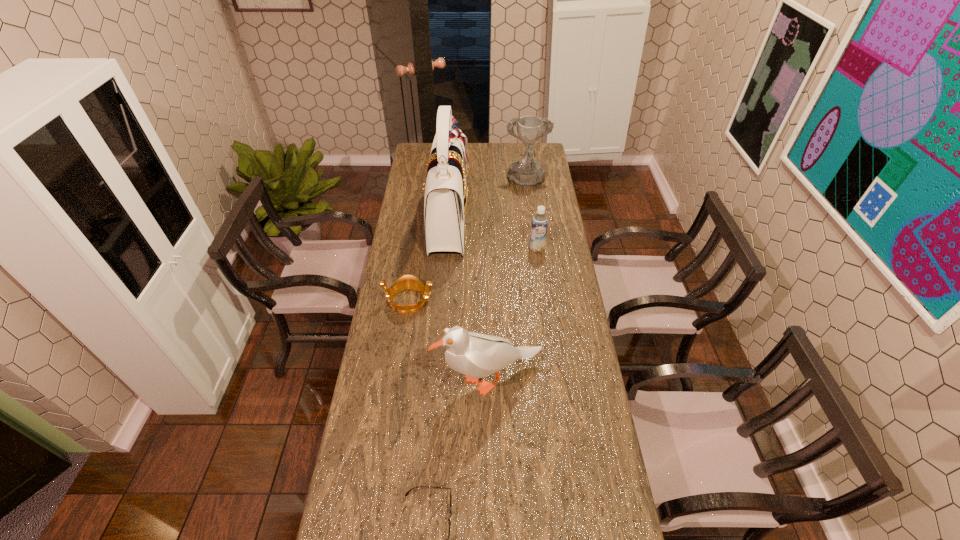
In the image, there is a desktop. Find the location of `vacant space at the far right corner`. vacant space at the far right corner is located at coordinates (533, 157).

Image resolution: width=960 pixels, height=540 pixels. I want to click on free space between the tallest object and the fourth tallest object, so click(492, 233).

Where is `free space between the third shortest object and the second shortest object`? The width and height of the screenshot is (960, 540). free space between the third shortest object and the second shortest object is located at coordinates (473, 274).

This screenshot has width=960, height=540. What are the coordinates of `vacant point located between the second nearest object and the satchel` in the screenshot? It's located at (468, 299).

You are a GUI agent. You are given a task and a screenshot of the screen. Output one action in this format:
    pyautogui.click(x=<x>, y=<y>)
    Task: Click on the free point between the award and the tiara
    The height and width of the screenshot is (540, 960).
    Given the screenshot: What is the action you would take?
    pyautogui.click(x=468, y=241)

Identify the location of the fifth closest object to the gull. Image resolution: width=960 pixels, height=540 pixels. (527, 172).

Choose which object is the third nearest neighbor to the second nearest object. Please provide its 2D coordinates. Your answer should be formatted as a tuple, i.e. [(x, y)], where the tuple contains the x and y coordinates of a point satisfying the conditions above.

[(446, 196)]

This screenshot has width=960, height=540. Identify the location of blank area in the image that satisfies the following two spatial constraints: 1. on the side with emblem of the award; 2. at the front emblem of the second shortest object. (541, 301).

Where is `free space that satisfies the following two spatial constraints: 1. on the side with emblem of the award; 2. at the beak of the second nearest object`? This screenshot has width=960, height=540. free space that satisfies the following two spatial constraints: 1. on the side with emblem of the award; 2. at the beak of the second nearest object is located at coordinates (551, 380).

In order to click on free space that satisfies the following two spatial constraints: 1. on the side with emblem of the award; 2. at the beak of the gull in this screenshot , I will do `click(551, 380)`.